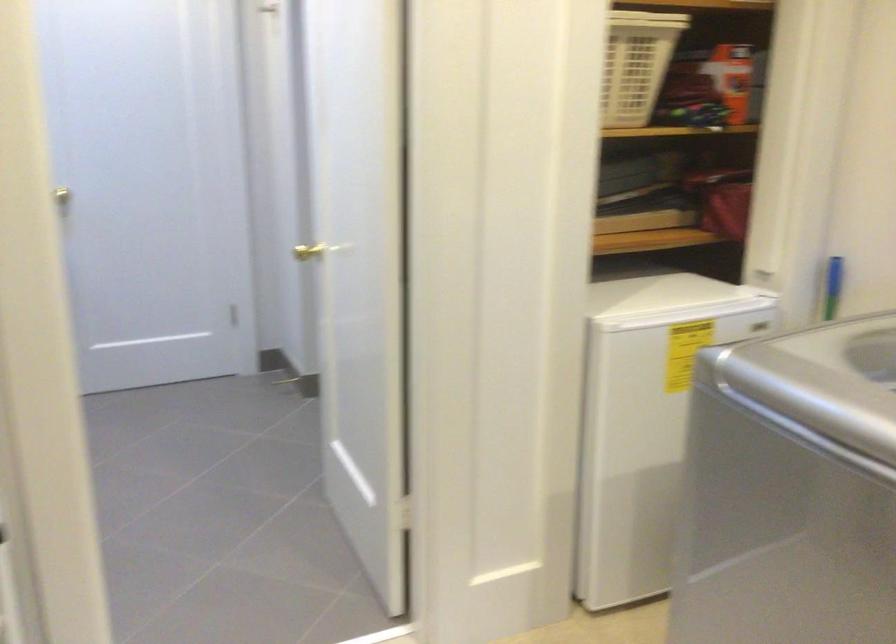
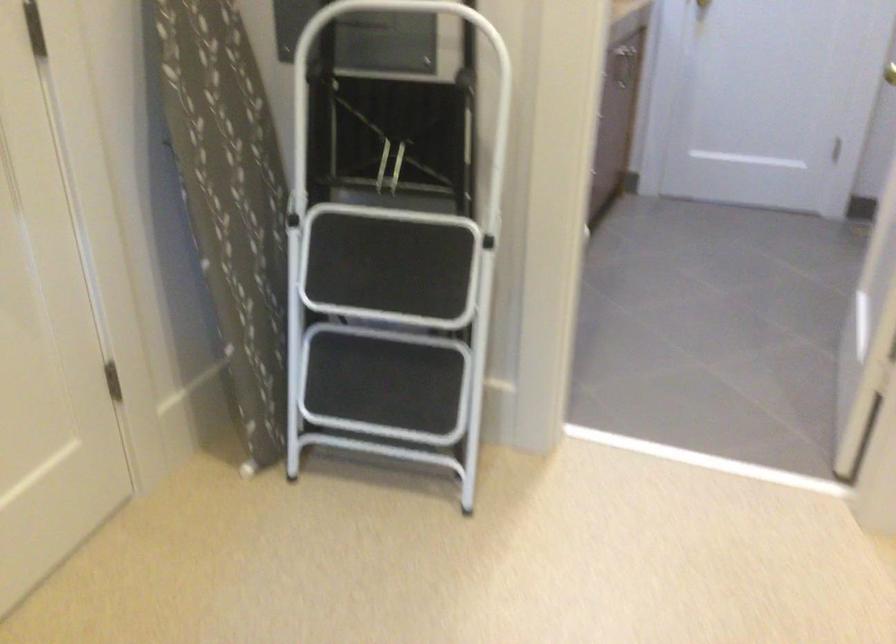
Locate, in the second image, the point that corresponds to (261,245) in the first image.

(890, 73)